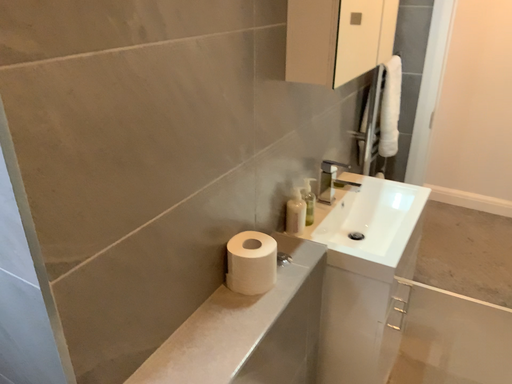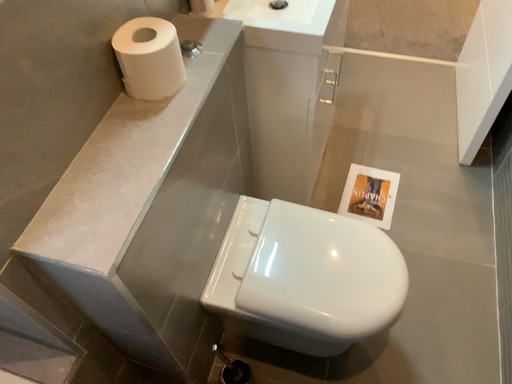
Question: How did the camera likely rotate when shooting the video?

Choices:
 (A) rotated downward
 (B) rotated upward

Answer: (A)